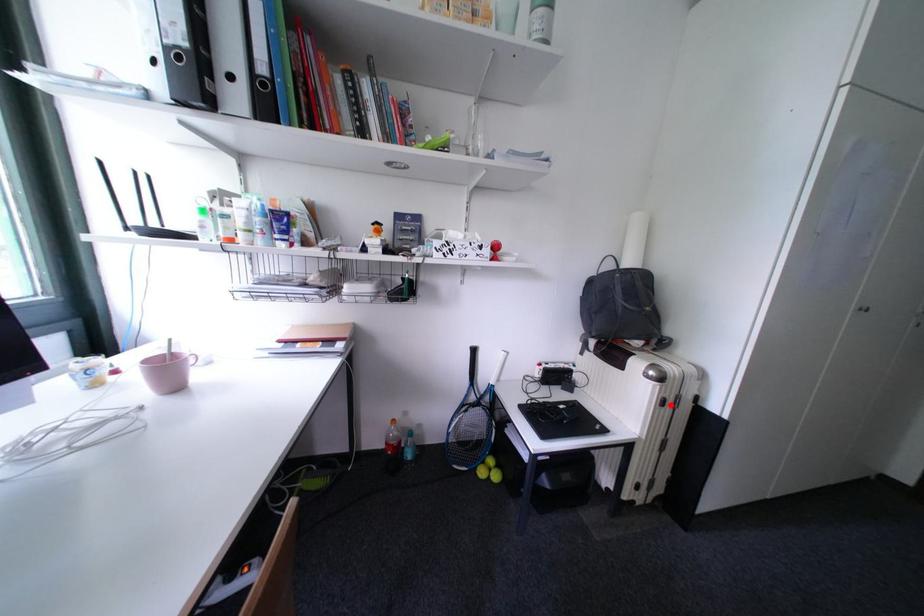
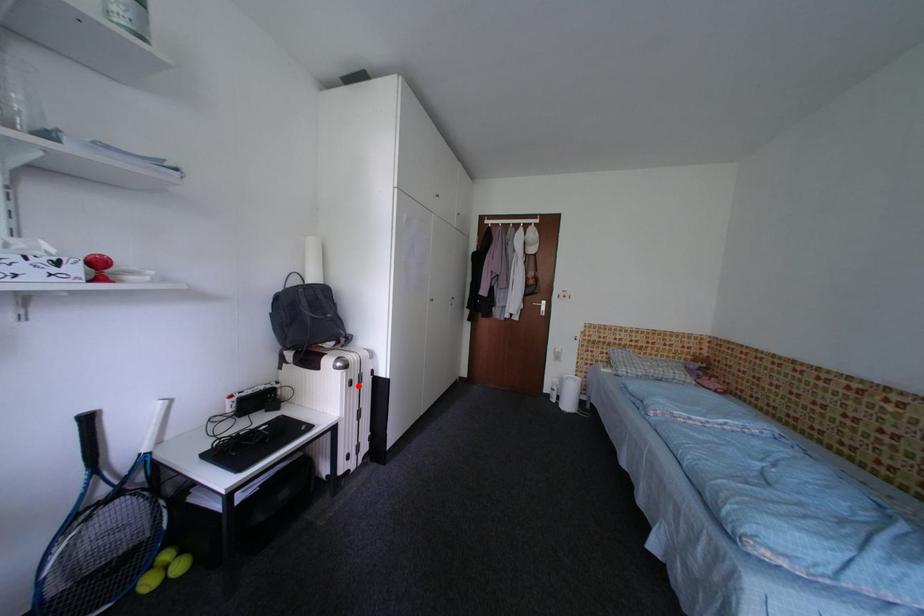
I am providing you with two images of the same scene from different viewpoints. A red point is marked on the first image and another point is marked on the second image. Are the points marked in image1 and image2 representing the same 3D position?

Yes